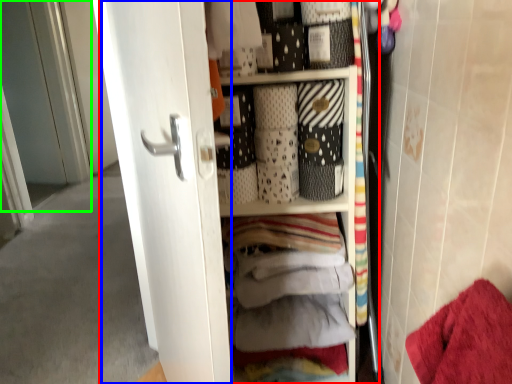
Question: Considering the real-world distances, which object is farthest from dresser (highlighted by a red box)? screen door (highlighted by a blue box) or screen door (highlighted by a green box)?

Choices:
 (A) screen door
 (B) screen door

Answer: (B)